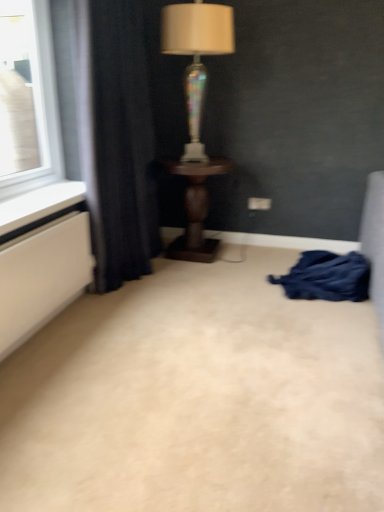
This screenshot has width=384, height=512. Identify the location of dark blue fabric at lower right. (327, 277).

Find the location of `iridescent glass lamp at center`. iridescent glass lamp at center is located at coordinates click(196, 55).

What is the approximate height of iridescent glass lamp at center?

It is 36.66 inches.

What do you see at coordinates (197, 398) in the screenshot? I see `beige carpet at center` at bounding box center [197, 398].

What is the approximate height of beige carpet at center?

It is 6.68 centimeters.

The width and height of the screenshot is (384, 512). I want to click on dark wood table at center, so pyautogui.click(x=195, y=208).

Would you consider beige carpet at center to be distant from dark blue fabric at lower right?

No, there isn't a large distance between beige carpet at center and dark blue fabric at lower right.

From the picture: Considering the relative sizes of beige carpet at center and dark blue fabric at lower right in the image provided, is beige carpet at center thinner than dark blue fabric at lower right?

No.

Is beige carpet at center shorter than dark blue fabric at lower right?

Yes.

Can dark blue fabric at lower right be found inside beige carpet at center?

Actually, dark blue fabric at lower right is outside beige carpet at center.

Is dark blue fabric at left next to iridescent glass lamp at center and touching it?

No, dark blue fabric at left is not making contact with iridescent glass lamp at center.

Considering the relative sizes of dark blue fabric at left and iridescent glass lamp at center in the image provided, is dark blue fabric at left thinner than iridescent glass lamp at center?

Correct, the width of dark blue fabric at left is less than that of iridescent glass lamp at center.

How many degrees apart are the facing directions of dark blue fabric at left and iridescent glass lamp at center?

89.3 degrees separate the facing orientations of dark blue fabric at left and iridescent glass lamp at center.

This screenshot has width=384, height=512. What are the coordinates of `table above the dark blue fabric at lower right (from a real-world perspective)` in the screenshot? It's located at (195, 208).

Is dark wood table at center aimed at dark blue fabric at lower right?

No, dark wood table at center is not aimed at dark blue fabric at lower right.

Which object is further away from the camera, dark wood table at center or dark blue fabric at lower right?

dark wood table at center is further away from the camera.

Can you confirm if dark wood table at center is positioned to the left of dark blue fabric at lower right?

Yes.

Does beige carpet at center lie behind iridescent glass lamp at center?

No.

Which of these two, beige carpet at center or iridescent glass lamp at center, is thinner?

With smaller width is iridescent glass lamp at center.

From a real-world perspective, which object rests below the other?

beige carpet at center is physically lower.

Who is bigger, beige carpet at center or iridescent glass lamp at center?

beige carpet at center is bigger.

From a real-world perspective, does dark blue fabric at lower right sit lower than iridescent glass lamp at center?

Yes, from a real-world perspective, dark blue fabric at lower right is below iridescent glass lamp at center.

Is dark blue fabric at lower right to the left or to the right of iridescent glass lamp at center in the image?

dark blue fabric at lower right is positioned on iridescent glass lamp at center's right side.

Where is `lamp that appears above the dark blue fabric at lower right (from a real-world perspective)`? lamp that appears above the dark blue fabric at lower right (from a real-world perspective) is located at coordinates (196, 55).

Between point (358, 292) and point (222, 19), which one is positioned behind?

Positioned behind is point (222, 19).

Which is behind, dark wood table at center or iridescent glass lamp at center?

dark wood table at center.

Who is smaller, dark wood table at center or iridescent glass lamp at center?

Smaller between the two is iridescent glass lamp at center.

Is iridescent glass lamp at center a part of dark wood table at center?

No.

From the image's perspective, which is below, dark blue fabric at left or dark wood table at center?

dark wood table at center, from the image's perspective.

Considering the relative sizes of dark blue fabric at left and dark wood table at center in the image provided, is dark blue fabric at left wider than dark wood table at center?

Incorrect, the width of dark blue fabric at left does not surpass that of dark wood table at center.

Are dark blue fabric at left and dark wood table at center beside each other?

No, dark blue fabric at left is not in contact with dark wood table at center.

From a real-world perspective, does dark blue fabric at left stand above dark wood table at center?

Correct, in the physical world, dark blue fabric at left is higher than dark wood table at center.

Image resolution: width=384 pixels, height=512 pixels. What are the coordinates of `blanket on the right side of beige carpet at center` in the screenshot? It's located at (327, 277).

Locate an element on the screen. This screenshot has height=512, width=384. curtain lying on the left of iridescent glass lamp at center is located at coordinates (118, 143).

Considering their positions, is dark blue fabric at left positioned closer to iridescent glass lamp at center than beige carpet at center?

dark blue fabric at left is closer to iridescent glass lamp at center.

Estimate the real-world distances between objects in this image. Which object is closer to dark wood table at center, dark blue fabric at left or iridescent glass lamp at center?

dark blue fabric at left.

Which object lies nearer to the anchor point beige carpet at center, dark wood table at center or dark blue fabric at lower right?

Based on the image, dark blue fabric at lower right appears to be nearer to beige carpet at center.

When comparing their distances from beige carpet at center, does dark blue fabric at left or dark wood table at center seem closer?

Based on the image, dark blue fabric at left appears to be nearer to beige carpet at center.

When comparing their distances from dark blue fabric at lower right, does dark blue fabric at left or beige carpet at center seem closer?

beige carpet at center is positioned closer to the anchor dark blue fabric at lower right.

Based on their spatial positions, is dark blue fabric at left or iridescent glass lamp at center further from dark blue fabric at lower right?

iridescent glass lamp at center.

When comparing their distances from dark blue fabric at left, does dark wood table at center or dark blue fabric at lower right seem closer?

Based on the image, dark wood table at center appears to be nearer to dark blue fabric at left.

Looking at this image, from the image, which object appears to be farther from iridescent glass lamp at center, dark blue fabric at lower right or beige carpet at center?

beige carpet at center.

Where is `table between iridescent glass lamp at center and dark blue fabric at lower right from top to bottom`? The width and height of the screenshot is (384, 512). table between iridescent glass lamp at center and dark blue fabric at lower right from top to bottom is located at coordinates (195, 208).

This screenshot has height=512, width=384. Identify the location of blanket between iridescent glass lamp at center and beige carpet at center in the up-down direction. (327, 277).

At what (x,y) coordinates should I click in order to perform the action: click on table between iridescent glass lamp at center and beige carpet at center from top to bottom. Please return your answer as a coordinate pair (x, y). Image resolution: width=384 pixels, height=512 pixels. Looking at the image, I should click on (195, 208).

At what (x,y) coordinates should I click in order to perform the action: click on blanket positioned between beige carpet at center and dark wood table at center from near to far. Please return your answer as a coordinate pair (x, y). Looking at the image, I should click on (327, 277).